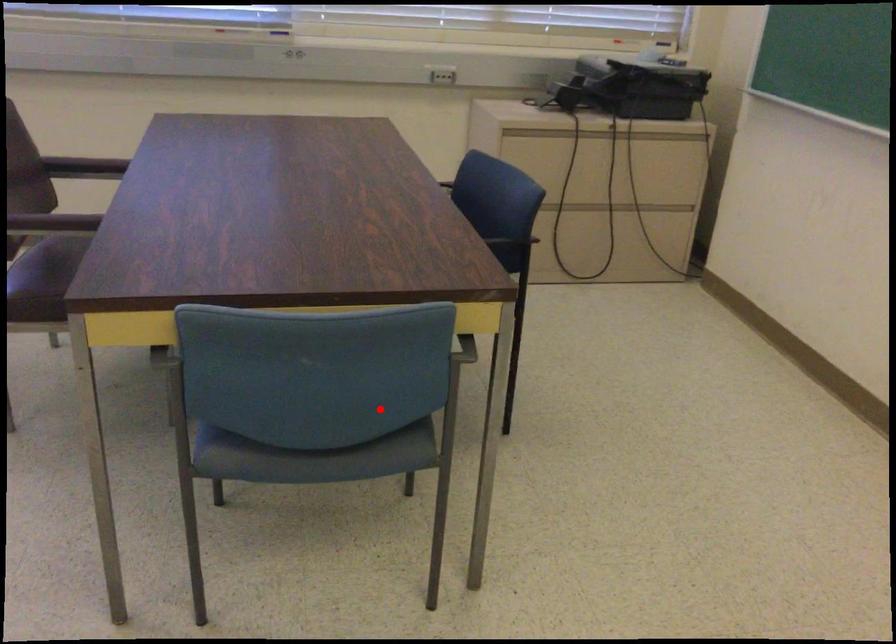
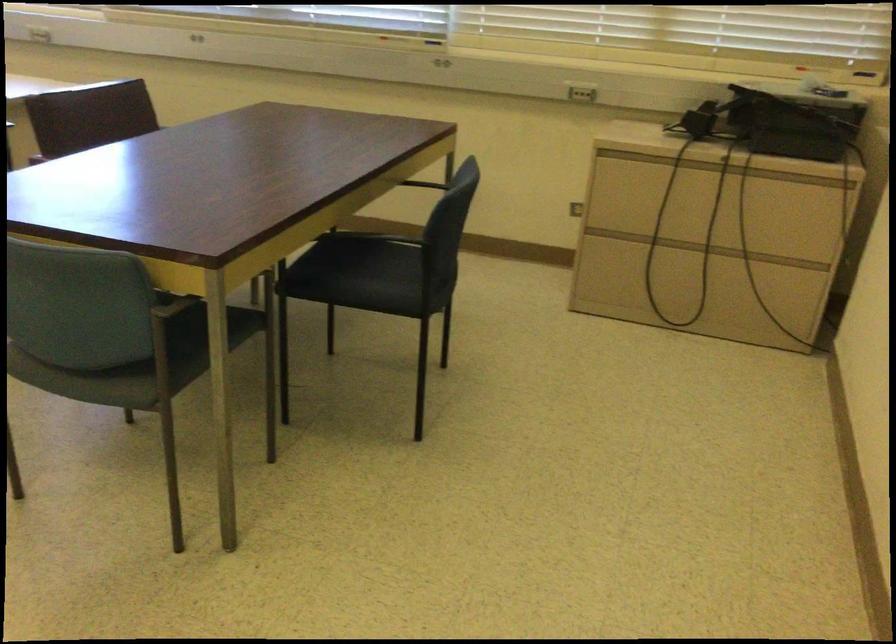
Question: A red point is marked in image1. In image2, is the corresponding 3D point closer to the camera or farther? Reply with the corresponding letter.

Choices:
 (A) The corresponding 3D point is closer.
 (B) The corresponding 3D point is farther.

Answer: (B)